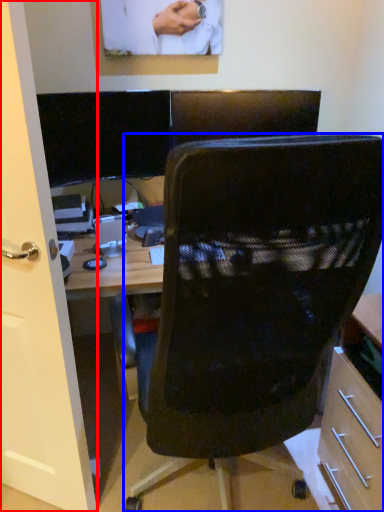
Question: Which object is closer to the camera taking this photo, glass door (highlighted by a red box) or chair (highlighted by a blue box)?

Choices:
 (A) glass door
 (B) chair

Answer: (B)